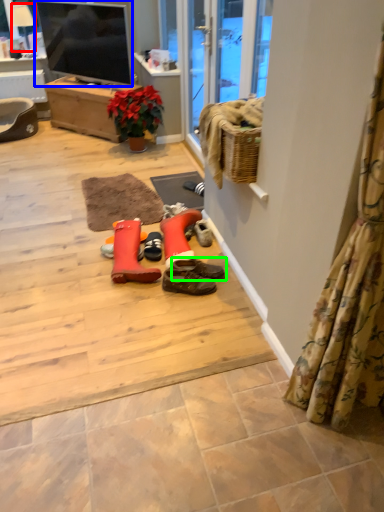
Question: Estimate the real-world distances between objects in this image. Which object is farther from lamp (highlighted by a red box), television (highlighted by a blue box) or footwear (highlighted by a green box)?

Choices:
 (A) television
 (B) footwear

Answer: (B)